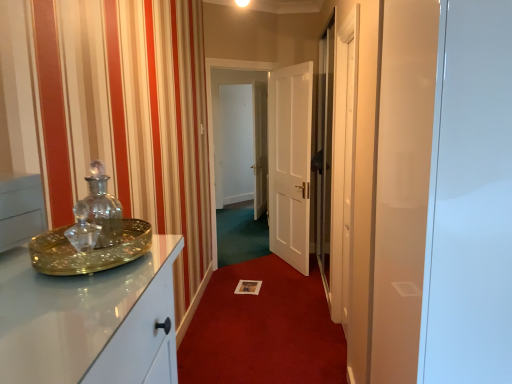
Question: From a real-world perspective, is transparent glass door at center, which appears as the first glass door when viewed from the left, physically below transparent glass door at right, the first glass door positioned from the front?

Choices:
 (A) no
 (B) yes

Answer: (B)

Question: Considering the relative sizes of transparent glass door at center, the second glass door viewed from the front, and transparent glass door at right, which appears as the first glass door when viewed from the right, in the image provided, is transparent glass door at center, the second glass door viewed from the front, thinner than transparent glass door at right, which appears as the first glass door when viewed from the right,?

Choices:
 (A) yes
 (B) no

Answer: (A)

Question: Is transparent glass door at center, which appears as the first glass door when viewed from the left, wider than transparent glass door at right, which appears as the first glass door when viewed from the right?

Choices:
 (A) yes
 (B) no

Answer: (B)

Question: Is transparent glass door at center, the second glass door in the right-to-left sequence, facing away from transparent glass door at right, acting as the second glass door starting from the left?

Choices:
 (A) no
 (B) yes

Answer: (A)

Question: Is transparent glass door at center, positioned as the first glass door in back-to-front order, to the left of transparent glass door at right, the first glass door positioned from the front, from the viewer's perspective?

Choices:
 (A) yes
 (B) no

Answer: (A)

Question: Is the depth of transparent glass door at center, positioned as the first glass door in back-to-front order, greater than that of transparent glass door at right, acting as the second glass door starting from the left?

Choices:
 (A) yes
 (B) no

Answer: (A)

Question: Does white paper at center have a lesser width compared to transparent glass door at center, the second glass door in the right-to-left sequence?

Choices:
 (A) no
 (B) yes

Answer: (A)

Question: From the image's perspective, is white paper at center over transparent glass door at center, the second glass door in the right-to-left sequence?

Choices:
 (A) yes
 (B) no

Answer: (B)

Question: Does white paper at center have a greater width compared to transparent glass door at center, the second glass door in the right-to-left sequence?

Choices:
 (A) no
 (B) yes

Answer: (B)

Question: Is white paper at center to the right of transparent glass door at center, the second glass door viewed from the front, from the viewer's perspective?

Choices:
 (A) yes
 (B) no

Answer: (A)

Question: Could transparent glass door at center, the second glass door viewed from the front, be considered to be inside white paper at center?

Choices:
 (A) yes
 (B) no

Answer: (B)

Question: Could you tell me if white paper at center is turned towards transparent glass door at center, the second glass door in the right-to-left sequence?

Choices:
 (A) yes
 (B) no

Answer: (B)

Question: Is white paper at center completely or partially outside of matte glass tray at left?

Choices:
 (A) no
 (B) yes

Answer: (B)